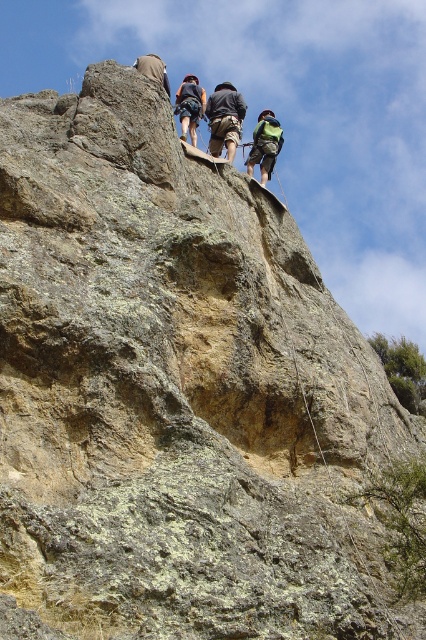
Who is taller, camouflage pants at center or dark blue jeans at upper center?

Standing taller between the two is dark blue jeans at upper center.

What do you see at coordinates (224, 118) in the screenshot?
I see `camouflage pants at center` at bounding box center [224, 118].

I want to click on camouflage pants at center, so click(x=224, y=118).

Is green fabric backpack at upper right smaller than dark blue jeans at upper center?

No, green fabric backpack at upper right is not smaller than dark blue jeans at upper center.

Can you confirm if green fabric backpack at upper right is positioned below dark blue jeans at upper center?

Yes, green fabric backpack at upper right is below dark blue jeans at upper center.

Which is in front, point (273, 122) or point (181, 112)?

Point (181, 112)

Where is `green fabric backpack at upper right`? The image size is (426, 640). green fabric backpack at upper right is located at coordinates (264, 145).

Who is more forward, (218, 102) or (247, 161)?

Point (247, 161) is in front.

Does camouflage pants at center have a smaller size compared to green fabric backpack at upper right?

Indeed, camouflage pants at center has a smaller size compared to green fabric backpack at upper right.

Is point (227, 134) behind point (268, 125)?

That is False.

Find the location of a particular element. The width and height of the screenshot is (426, 640). camouflage pants at center is located at coordinates (224, 118).